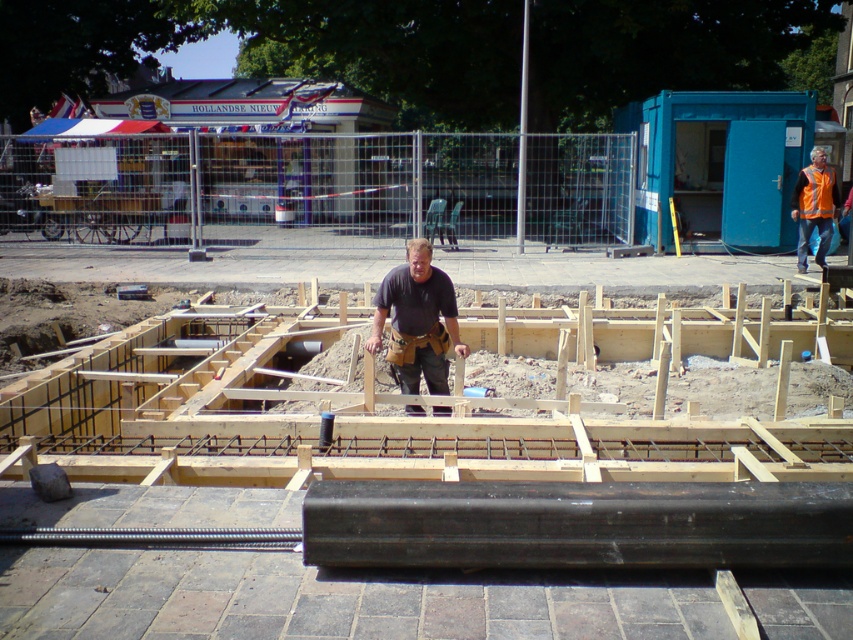
You are standing at the construction site and want to walk from the point marked as point (434,372) to the point marked as point (807,182). Which direction should you head to reach your destination?

You should head north because point (434,372) is in front of point (807,182), indicating that moving north would bring you closer to the destination.

Looking at this image, you are a construction worker who needs to retrieve your tool belt. You are currently standing near the orange reflective vest at right. Which direction should you move to reach the brown leather tool belt at center?

The brown leather tool belt at center is to the left of the orange reflective vest at right, so you should move to your left to reach it.